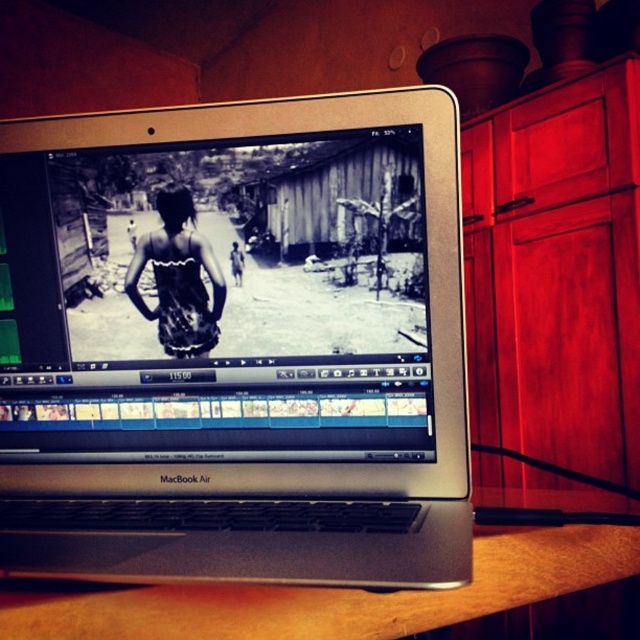
You are setting up a workspace and need to place both the silver metallic laptop at center and the wooden table at lower center on a shelf. The shelf has limited depth. Which object should you place closer to the edge of the shelf to ensure both fit?

The silver metallic laptop at center is thinner than the wooden table at lower center, so you should place the wooden table at lower center closer to the edge of the shelf to accommodate its greater thickness.

You are a graphic designer working on a MacBook Air laptop. You have two points marked on your screen at coordinates point [209,630] and point [189,268]. Which point is closer to the viewer?

Point [209,630] is in front of point [189,268], so it is closer to the viewer.